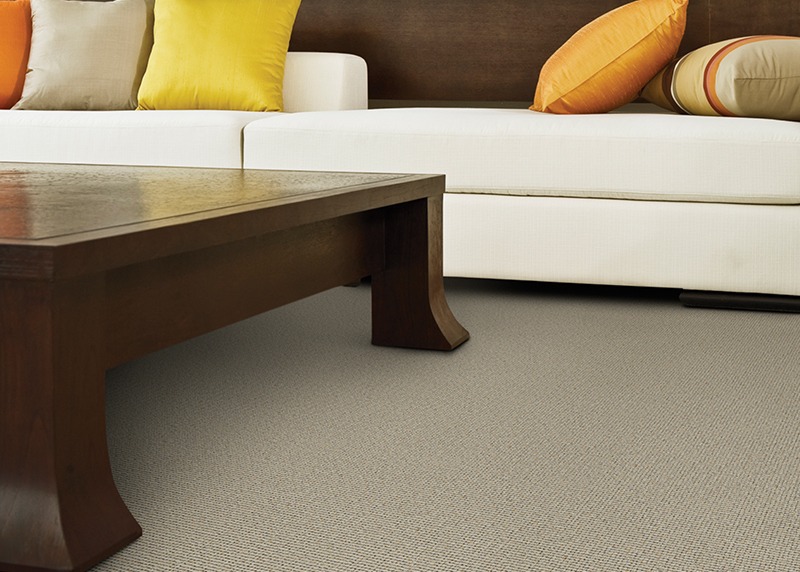
Locate an element on the screen. The height and width of the screenshot is (572, 800). table is located at coordinates (133, 194).